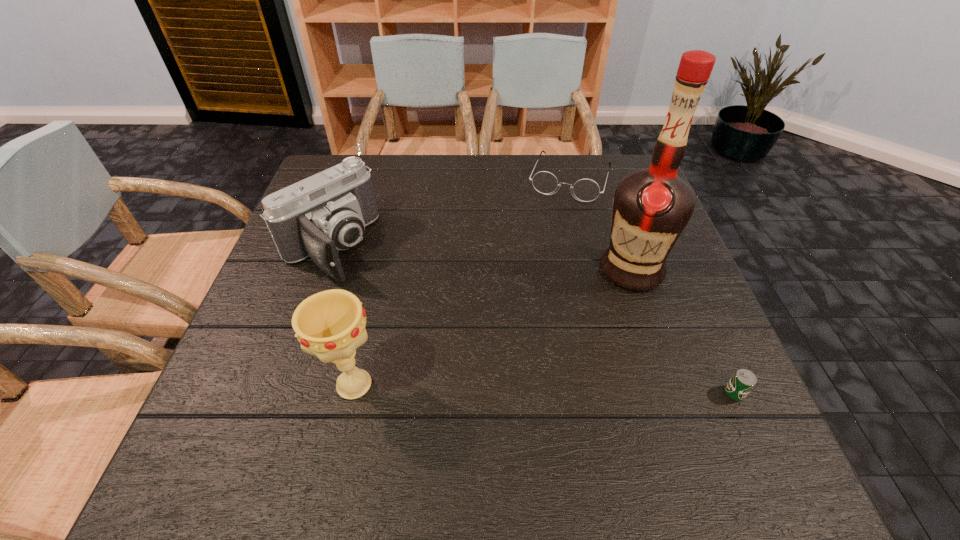
Where is `object located at the left edge`? The height and width of the screenshot is (540, 960). object located at the left edge is located at coordinates (326, 212).

Image resolution: width=960 pixels, height=540 pixels. Identify the location of beer can that is at the right edge. (743, 381).

Locate an element on the screen. The height and width of the screenshot is (540, 960). liquor positioned at the right edge is located at coordinates (651, 207).

Find the location of `spectacles that is at the right edge`. spectacles that is at the right edge is located at coordinates (586, 190).

Locate an element on the screen. The height and width of the screenshot is (540, 960). object present at the far right corner is located at coordinates (586, 190).

I want to click on object at the near right corner, so click(x=743, y=381).

At what (x,y) coordinates should I click in order to perform the action: click on vacant space at the far edge of the desktop. Please return your answer as a coordinate pair (x, y). The width and height of the screenshot is (960, 540). Looking at the image, I should click on (454, 168).

In the image, there is a desktop. At what (x,y) coordinates should I click in order to perform the action: click on blank space at the near edge. Please return your answer as a coordinate pair (x, y). Looking at the image, I should click on (601, 420).

The image size is (960, 540). In the image, there is a desktop. Find the location of `vacant area at the left edge`. vacant area at the left edge is located at coordinates (282, 266).

Where is `vacant space at the right edge of the desktop`? This screenshot has width=960, height=540. vacant space at the right edge of the desktop is located at coordinates (694, 315).